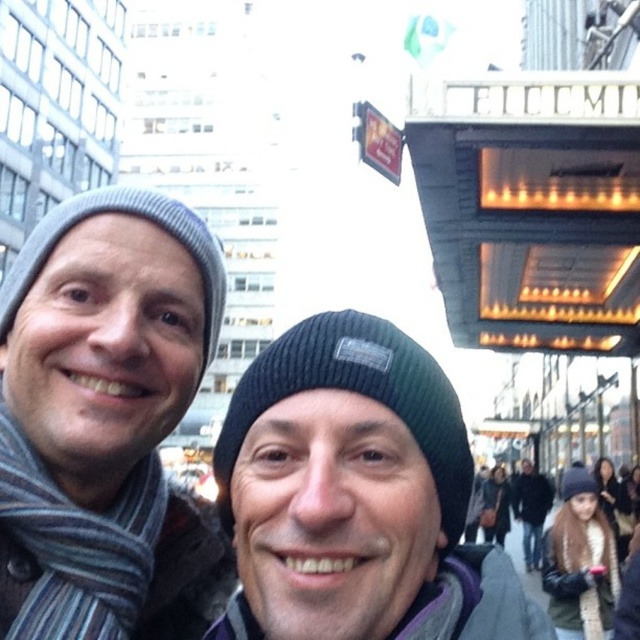
You are a photographer trying to capture a closeup of the sign with the letters ELLCMI in the background. You have two points marked on your viewfinder at coordinates point (40,593) and point (522,548). Which point should you focus on to ensure the sign is in sharp focus?

You should focus on point (40,593) because it is closer to the viewer than point (522,548), so focusing there will keep the sign in sharp focus.

You are a photographer trying to capture the gray knit beanie at left in your shot. Based on its 2D coordinates, where should you position your camera to ensure it is centered in the frame?

The gray knit beanie at left is located at the 2D coordinates point (99,424), so you should position your camera so that this point is at the center of the frame to capture it.

You are a photographer taking a picture of two people standing on a city street. You notice the black knit beanie at center and the striped wool scarf at left. Which object is positioned closer to the camera?

The black knit beanie at center is closer to the viewer than the striped wool scarf at left, so the black knit beanie at center is positioned closer to the camera.